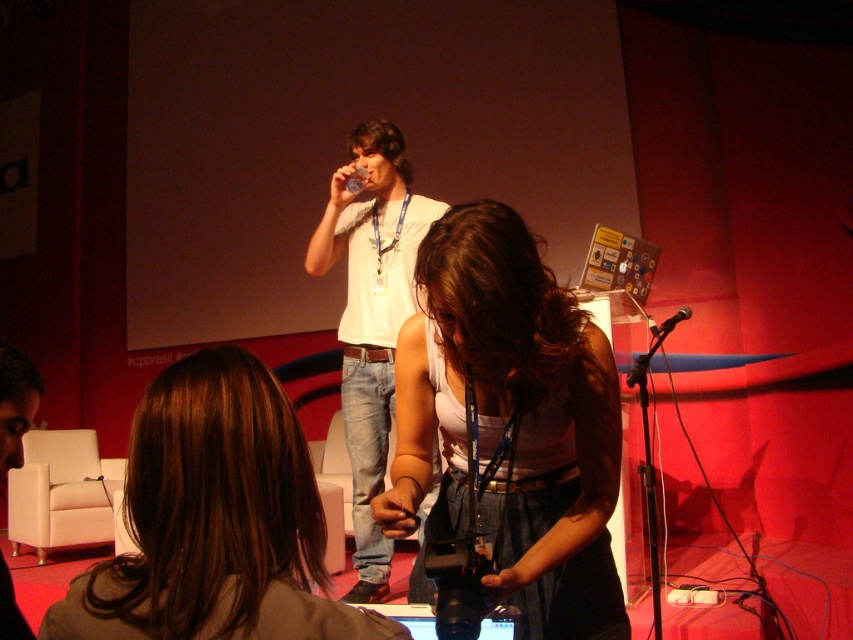
Question: Which point is farther to the camera?

Choices:
 (A) (682, 310)
 (B) (189, 540)
 (C) (381, 250)

Answer: (C)

Question: Which of the following is the farthest from the observer?

Choices:
 (A) (444, 582)
 (B) (653, 326)

Answer: (B)

Question: Can you confirm if brown hair at center is positioned above black plastic microphone at center?

Choices:
 (A) no
 (B) yes

Answer: (A)

Question: Can you confirm if matte white tank top at center is positioned to the left of black plastic microphone at center?

Choices:
 (A) no
 (B) yes

Answer: (B)

Question: Which point is farther to the camera?

Choices:
 (A) white cotton shirt at center
 (B) black plastic video camera at center
 (C) matte white tank top at center

Answer: (A)

Question: Can you confirm if white cotton shirt at center is thinner than black plastic video camera at center?

Choices:
 (A) no
 (B) yes

Answer: (A)